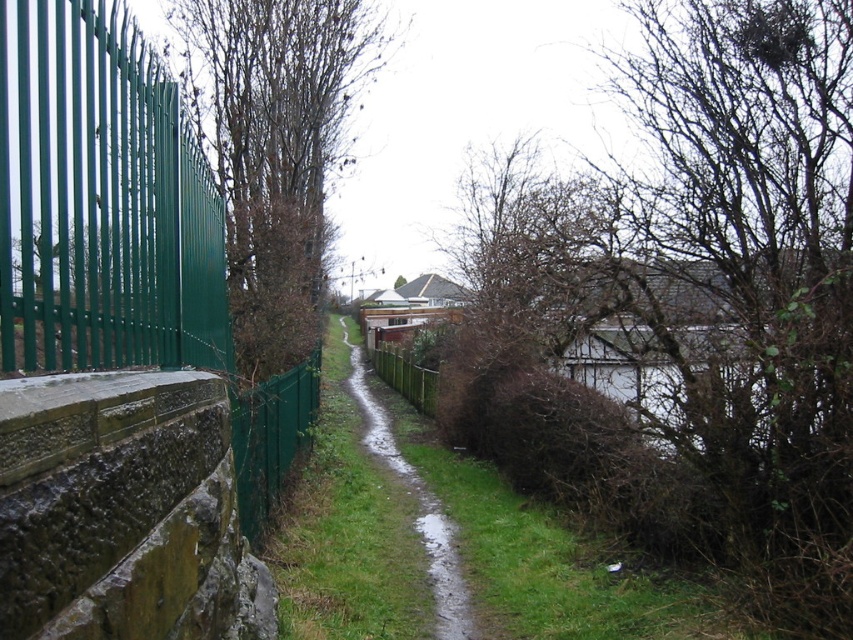
Is point (558, 563) positioned after point (204, 112)?

That is False.

Who is more distant from viewer, (434,554) or (280,29)?

Point (280,29)

Which is behind, point (311, 518) or point (369, 60)?

Positioned behind is point (369, 60).

Locate an element on the screen. The image size is (853, 640). green grass at center is located at coordinates (544, 556).

Image resolution: width=853 pixels, height=640 pixels. I want to click on green metal fence at left, so click(x=122, y=230).

Can you confirm if green metal fence at left is positioned to the left of green grass at center?

Correct, you'll find green metal fence at left to the left of green grass at center.

The height and width of the screenshot is (640, 853). What do you see at coordinates (122, 230) in the screenshot?
I see `green metal fence at left` at bounding box center [122, 230].

Where is `green metal fence at left`? The height and width of the screenshot is (640, 853). green metal fence at left is located at coordinates (122, 230).

Which is above, green metal fence at left or wet grass at center?

green metal fence at left is higher up.

Find the location of a particular element. green metal fence at left is located at coordinates (122, 230).

Image resolution: width=853 pixels, height=640 pixels. Find the location of `green metal fence at left`. green metal fence at left is located at coordinates (122, 230).